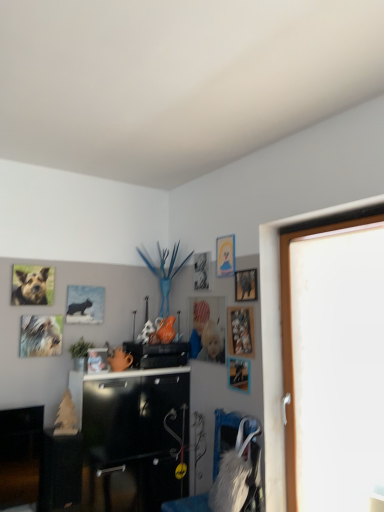
I want to click on metallic gold picture frame at upper center, which ranks as the fourth picture frame in right-to-left order, so tap(225, 256).

The height and width of the screenshot is (512, 384). Describe the element at coordinates (97, 360) in the screenshot. I see `metallic silver picture frame at center, the 7th picture frame viewed from the right` at that location.

This screenshot has width=384, height=512. What do you see at coordinates (239, 374) in the screenshot?
I see `wooden picture frame at upper right, the 3th picture frame from the right` at bounding box center [239, 374].

I want to click on brown fur dog at upper left, acting as the 2th animal starting from the bottom, so click(x=31, y=288).

You are a GUI agent. You are given a task and a screenshot of the screen. Output one action in this format:
    pyautogui.click(x=<x>, y=<y>)
    Task: Click on the matte black picture frame at upper left, the first picture frame in the left-to-right sequence
    This screenshot has height=512, width=384.
    Given the screenshot: What is the action you would take?
    pyautogui.click(x=85, y=304)

Does brown fur dog at upper left, the first animal in the top-to-bottom sequence, come in front of wooden picture frame at upper right, marked as the 6th picture frame in a left-to-right arrangement?

That is False.

Considering the positions of objects brown fur dog at upper left, the first animal in the top-to-bottom sequence, and wooden picture frame at upper right, the 3th picture frame from the right, in the image provided, who is more to the left, brown fur dog at upper left, the first animal in the top-to-bottom sequence, or wooden picture frame at upper right, the 3th picture frame from the right,?

brown fur dog at upper left, the first animal in the top-to-bottom sequence, is more to the left.

Based on the photo, could you measure the distance between brown fur dog at upper left, the first animal in the top-to-bottom sequence, and wooden picture frame at upper right, marked as the 6th picture frame in a left-to-right arrangement?

brown fur dog at upper left, the first animal in the top-to-bottom sequence, and wooden picture frame at upper right, marked as the 6th picture frame in a left-to-right arrangement, are 5.15 feet apart.

From a real-world perspective, who is located lower, brown fur dog at upper left, the first animal in the top-to-bottom sequence, or wooden picture frame at upper right, the 3th picture frame from the right?

From a 3D spatial view, wooden picture frame at upper right, the 3th picture frame from the right, is below.

Does point (250, 298) come closer to viewer compared to point (234, 256)?

Yes, point (250, 298) is closer to viewer.

From the image's perspective, is metallic silver picture frame at upper right, marked as the eighth picture frame in a left-to-right arrangement, over metallic gold picture frame at upper center, positioned as the 5th picture frame in left-to-right order?

No, from the image's perspective, metallic silver picture frame at upper right, marked as the eighth picture frame in a left-to-right arrangement, is not on top of metallic gold picture frame at upper center, positioned as the 5th picture frame in left-to-right order.

Can you confirm if metallic silver picture frame at upper right, the first picture frame when ordered from right to left, is shorter than metallic gold picture frame at upper center, positioned as the 5th picture frame in left-to-right order?

Yes.

Is metallic gold picture frame at upper center, positioned as the 5th picture frame in left-to-right order, a part of metallic silver picture frame at upper right, the first picture frame when ordered from right to left?

No, metallic gold picture frame at upper center, positioned as the 5th picture frame in left-to-right order, is not a part of metallic silver picture frame at upper right, the first picture frame when ordered from right to left.

Based on the photo, would you consider matte plastic picture frame at center, arranged as the fifth picture frame when viewed from the right, to be distant from metallic gold picture frame at upper center, which ranks as the fourth picture frame in right-to-left order?

Actually, matte plastic picture frame at center, arranged as the fifth picture frame when viewed from the right, and metallic gold picture frame at upper center, which ranks as the fourth picture frame in right-to-left order, are a little close together.

Is point (208, 358) more distant than point (222, 252)?

Yes.

There is a metallic gold picture frame at upper center, which ranks as the fourth picture frame in right-to-left order. Where is `the 4th picture frame below it (from a real-world perspective)`? the 4th picture frame below it (from a real-world perspective) is located at coordinates (207, 329).

Can you confirm if matte plastic picture frame at center, the fourth picture frame in the left-to-right sequence, is thinner than metallic gold picture frame at upper center, which ranks as the fourth picture frame in right-to-left order?

No, matte plastic picture frame at center, the fourth picture frame in the left-to-right sequence, is not thinner than metallic gold picture frame at upper center, which ranks as the fourth picture frame in right-to-left order.

Considering the relative sizes of black matte speaker at center and metallic silver picture frame at center, the 7th picture frame viewed from the right, in the image provided, is black matte speaker at center shorter than metallic silver picture frame at center, the 7th picture frame viewed from the right,?

Result: No, black matte speaker at center is not shorter than metallic silver picture frame at center, the 7th picture frame viewed from the right.

The height and width of the screenshot is (512, 384). Identify the location of the 1st picture frame above the black matte speaker at center (from the image's perspective). (97, 360).

Which is closer, (136, 353) or (103, 362)?

Positioned in front is point (103, 362).

Does black matte speaker at center have a larger size compared to metallic silver picture frame at center, placed as the second picture frame when sorted from left to right?

Indeed, black matte speaker at center has a larger size compared to metallic silver picture frame at center, placed as the second picture frame when sorted from left to right.

Which is in front, point (248, 275) or point (245, 507)?

The point (245, 507) is more forward.

Which of these two, metallic silver picture frame at upper right, the first picture frame when ordered from right to left, or white furry swivel chair at center, is bigger?

white furry swivel chair at center.

Find the location of `the 6th picture frame above the white furry swivel chair at center (from the image's perspective)`. the 6th picture frame above the white furry swivel chair at center (from the image's perspective) is located at coordinates (246, 285).

Between metallic silver picture frame at upper right, the first picture frame when ordered from right to left, and white furry swivel chair at center, which one has more height?

With more height is white furry swivel chair at center.

Based on the photo, would you say matte black picture frame at upper left, the first picture frame in the left-to-right sequence, is inside or outside wooden picture frame at upper right, the 3th picture frame from the right?

matte black picture frame at upper left, the first picture frame in the left-to-right sequence, is not enclosed by wooden picture frame at upper right, the 3th picture frame from the right.

Between matte black picture frame at upper left, the first picture frame in the left-to-right sequence, and wooden picture frame at upper right, marked as the 6th picture frame in a left-to-right arrangement, which one has smaller width?

With smaller width is wooden picture frame at upper right, marked as the 6th picture frame in a left-to-right arrangement.

What's the angular difference between matte black picture frame at upper left, which is the eighth picture frame from right to left, and wooden picture frame at upper right, the 3th picture frame from the right,'s facing directions?

88.9 degrees.

Is matte black picture frame at upper left, which is the eighth picture frame from right to left, beside wooden picture frame at upper right, marked as the 6th picture frame in a left-to-right arrangement?

No, matte black picture frame at upper left, which is the eighth picture frame from right to left, is not beside wooden picture frame at upper right, marked as the 6th picture frame in a left-to-right arrangement.

Considering the relative sizes of black glossy table at lower left and matte black picture frame at upper left, which is the eighth picture frame from right to left, in the image provided, is black glossy table at lower left smaller than matte black picture frame at upper left, which is the eighth picture frame from right to left,?

No, black glossy table at lower left is not smaller than matte black picture frame at upper left, which is the eighth picture frame from right to left.

Which object is thinner, black glossy table at lower left or matte black picture frame at upper left, which is the eighth picture frame from right to left?

matte black picture frame at upper left, which is the eighth picture frame from right to left.

The width and height of the screenshot is (384, 512). Identify the location of the 5th picture frame above the black glossy table at lower left (from the image's perspective). (85, 304).

The image size is (384, 512). Find the location of `the 6th picture frame directly beneath the brown fur dog at upper left, acting as the 2th animal starting from the bottom (from a real-world perspective)`. the 6th picture frame directly beneath the brown fur dog at upper left, acting as the 2th animal starting from the bottom (from a real-world perspective) is located at coordinates (239, 374).

From a real-world perspective, count 2nd picture frames upward from the metallic silver picture frame at upper right, marked as the eighth picture frame in a left-to-right arrangement, and point to it. Please provide its 2D coordinates.

[(225, 256)]

Considering their positions, is metallic silver picture frame at upper right, marked as the eighth picture frame in a left-to-right arrangement, positioned closer to wooden picture frame at upper right, the 3th picture frame from the right, than black matte speaker at center?

metallic silver picture frame at upper right, marked as the eighth picture frame in a left-to-right arrangement, is positioned closer to the anchor wooden picture frame at upper right, the 3th picture frame from the right.

When comparing their distances from metallic silver picture frame at upper right, marked as the eighth picture frame in a left-to-right arrangement, does metallic gold picture frame at upper center, positioned as the 5th picture frame in left-to-right order, or wooden picture frame at upper right, which ranks as the seventh picture frame in left-to-right order, seem closer?

metallic gold picture frame at upper center, positioned as the 5th picture frame in left-to-right order, lies closer to metallic silver picture frame at upper right, marked as the eighth picture frame in a left-to-right arrangement, than the other object.

Which object lies further to the anchor point white furry swivel chair at center, matte plastic picture frame at center, the fourth picture frame in the left-to-right sequence, or white wooden door at right?

matte plastic picture frame at center, the fourth picture frame in the left-to-right sequence, is positioned further to the anchor white furry swivel chair at center.

From the image, which object appears to be nearer to white fur dog at upper left, which is the second animal in top-to-bottom order, matte black picture frame at upper left, which is the eighth picture frame from right to left, or metallic silver photo frame at upper center, positioned as the sixth picture frame in right-to-left order?

matte black picture frame at upper left, which is the eighth picture frame from right to left.

Estimate the real-world distances between objects in this image. Which object is further from metallic silver picture frame at upper right, the first picture frame when ordered from right to left, white furry swivel chair at center or matte black picture frame at upper left, the first picture frame in the left-to-right sequence?

The object further to metallic silver picture frame at upper right, the first picture frame when ordered from right to left, is matte black picture frame at upper left, the first picture frame in the left-to-right sequence.

From the image, which object appears to be nearer to matte black picture frame at upper left, the first picture frame in the left-to-right sequence, metallic silver picture frame at center, placed as the second picture frame when sorted from left to right, or white furry swivel chair at center?

metallic silver picture frame at center, placed as the second picture frame when sorted from left to right, is positioned closer to the anchor matte black picture frame at upper left, the first picture frame in the left-to-right sequence.

When comparing their distances from matte plastic picture frame at center, arranged as the fifth picture frame when viewed from the right, does metallic gold picture frame at upper center, positioned as the 5th picture frame in left-to-right order, or metallic silver picture frame at upper right, marked as the eighth picture frame in a left-to-right arrangement, seem further?

metallic gold picture frame at upper center, positioned as the 5th picture frame in left-to-right order, is further to matte plastic picture frame at center, arranged as the fifth picture frame when viewed from the right.

Looking at the image, which one is located closer to metallic silver picture frame at upper right, the first picture frame when ordered from right to left, wooden picture frame at upper right, which ranks as the seventh picture frame in left-to-right order, or matte plastic picture frame at center, arranged as the fifth picture frame when viewed from the right?

wooden picture frame at upper right, which ranks as the seventh picture frame in left-to-right order, is closer to metallic silver picture frame at upper right, the first picture frame when ordered from right to left.

Image resolution: width=384 pixels, height=512 pixels. I want to click on appliance between brown fur dog at upper left, acting as the 2th animal starting from the bottom, and metallic gold picture frame at upper center, positioned as the 5th picture frame in left-to-right order, in the horizontal direction, so click(157, 354).

Where is `table between white fur dog at upper left, which is the second animal in top-to-bottom order, and wooden picture frame at upper right, which is the 2th picture frame from right to left, from left to right`? The height and width of the screenshot is (512, 384). table between white fur dog at upper left, which is the second animal in top-to-bottom order, and wooden picture frame at upper right, which is the 2th picture frame from right to left, from left to right is located at coordinates (60, 472).

You are a GUI agent. You are given a task and a screenshot of the screen. Output one action in this format:
    pyautogui.click(x=<x>, y=<y>)
    Task: Click on the appliance between white fur dog at upper left, which is the first animal in bottom-to-top order, and matte plastic picture frame at center, the fourth picture frame in the left-to-right sequence, in the horizontal direction
    The width and height of the screenshot is (384, 512).
    Given the screenshot: What is the action you would take?
    (x=157, y=354)

Where is `picture frame between white wooden door at right and wooden picture frame at upper right, the 3th picture frame from the right, along the z-axis`? The image size is (384, 512). picture frame between white wooden door at right and wooden picture frame at upper right, the 3th picture frame from the right, along the z-axis is located at coordinates (241, 331).